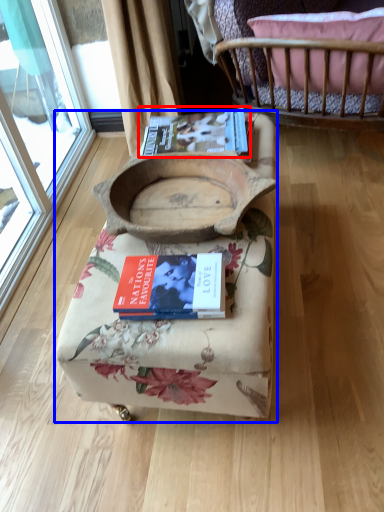
Question: Which object appears closest to the camera in this image, paperback book (highlighted by a red box) or furniture (highlighted by a blue box)?

Choices:
 (A) paperback book
 (B) furniture

Answer: (B)